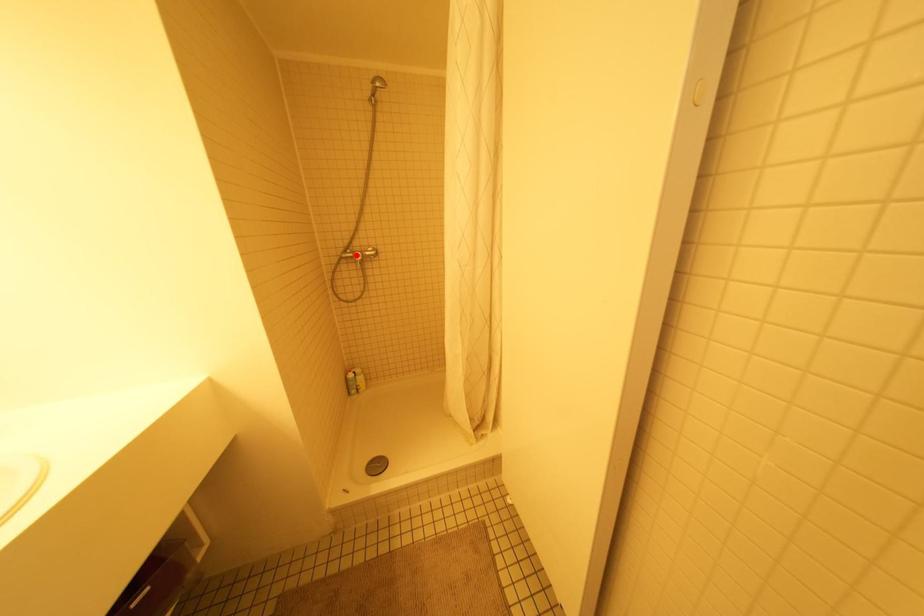
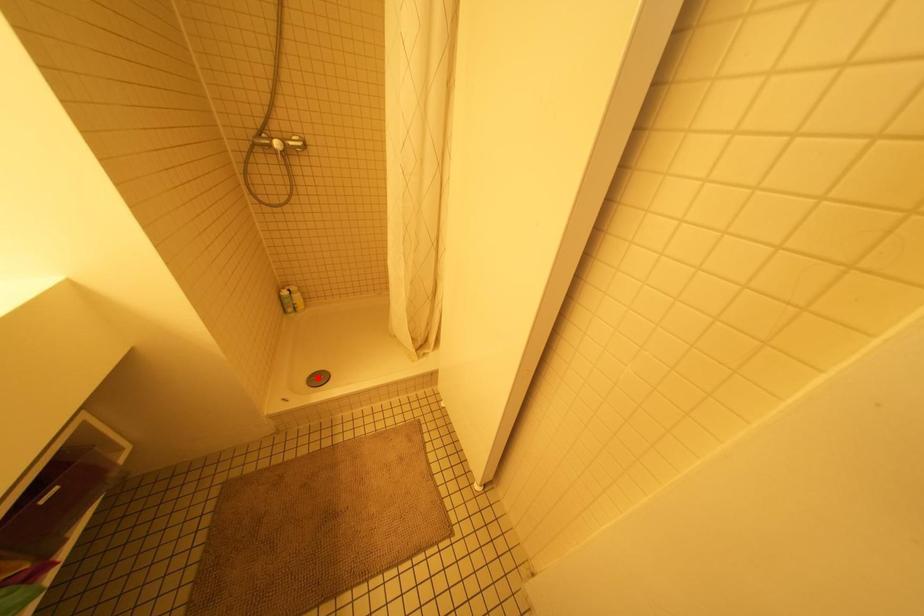
I am providing you with two images of the same scene from different viewpoints. A red point is marked on the first image and another point is marked on the second image. Is the marked point in image1 the same physical position as the marked point in image2?

No